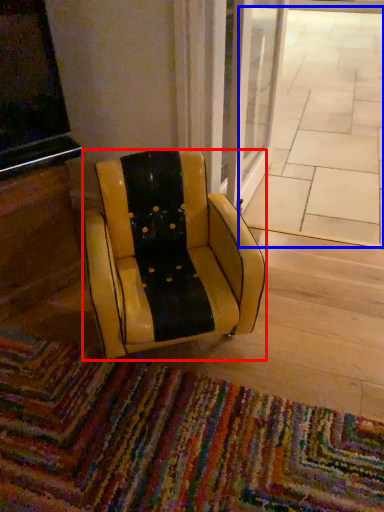
Question: Which point is further to the camera, chair (highlighted by a red box) or pavement (highlighted by a blue box)?

Choices:
 (A) chair
 (B) pavement

Answer: (B)